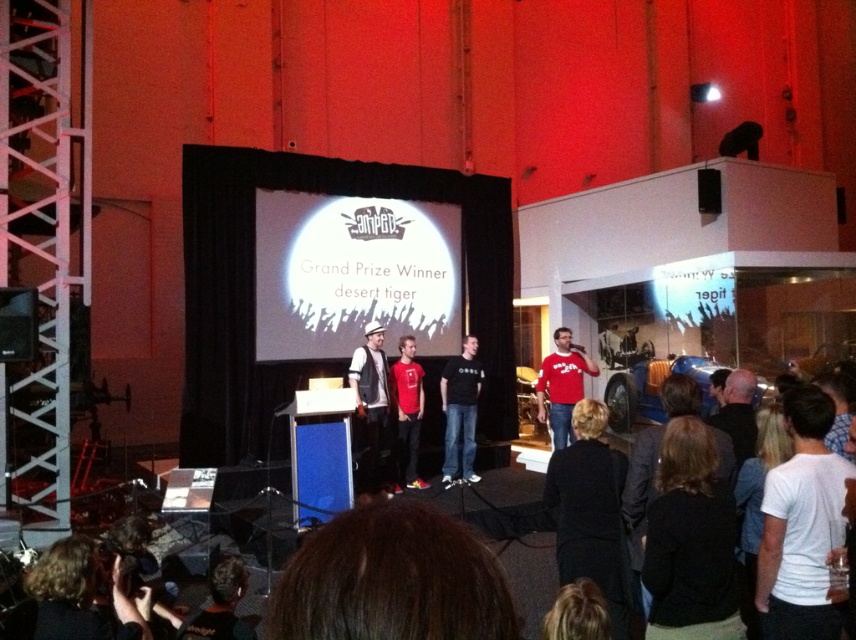
Can you confirm if black matte shirt at center is positioned below matte red shirt at center?

Indeed, black matte shirt at center is positioned under matte red shirt at center.

Who is shorter, black matte shirt at center or matte red shirt at center?

matte red shirt at center

Is point (447, 396) in front of point (545, 412)?

That is True.

This screenshot has height=640, width=856. Find the location of `black matte shirt at center`. black matte shirt at center is located at coordinates (461, 410).

Between matte red shirt at center and dark brown hair at lower center, which one is positioned lower?

dark brown hair at lower center is below.

Is matte red shirt at center bigger than dark brown hair at lower center?

Yes, matte red shirt at center is bigger than dark brown hair at lower center.

Is point (557, 445) farther from viewer compared to point (212, 586)?

Yes.

Image resolution: width=856 pixels, height=640 pixels. Find the location of `matte red shirt at center`. matte red shirt at center is located at coordinates (562, 385).

Who is more distant from viewer, (700, 493) or (357, 412)?

The point (357, 412) is behind.

Who is more forward, [724,492] or [369,467]?

Positioned in front is point [724,492].

I want to click on black fabric at lower right, so click(691, 540).